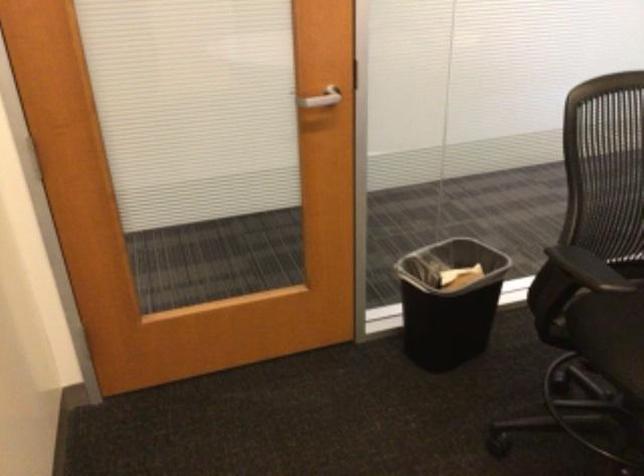
This screenshot has height=476, width=644. I want to click on silver door handle, so click(x=321, y=98).